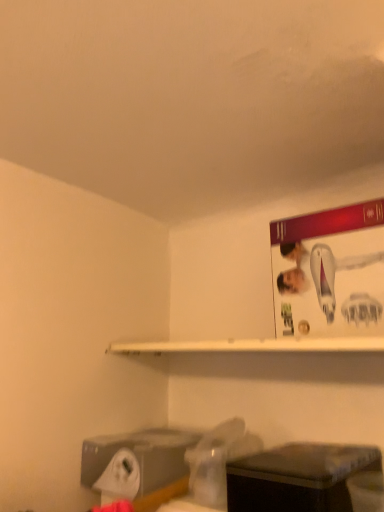
Question: Looking at the image, does white matte shelf at upper center seem bigger or smaller compared to black plastic box at lower right?

Choices:
 (A) big
 (B) small

Answer: (B)

Question: Considering their positions, is white matte shelf at upper center located in front of or behind black plastic box at lower right?

Choices:
 (A) front
 (B) behind

Answer: (B)

Question: From their relative heights in the image, would you say white matte shelf at upper center is taller or shorter than black plastic box at lower right?

Choices:
 (A) tall
 (B) short

Answer: (B)

Question: Looking at their shapes, would you say black plastic box at lower right is wider or thinner than white matte shelf at upper center?

Choices:
 (A) wide
 (B) thin

Answer: (A)

Question: Visually, is black plastic box at lower right positioned to the left or to the right of white matte shelf at upper center?

Choices:
 (A) left
 (B) right

Answer: (B)

Question: From a real-world perspective, is black plastic box at lower right positioned above or below white matte shelf at upper center?

Choices:
 (A) below
 (B) above

Answer: (A)

Question: Is black plastic box at lower right bigger or smaller than white matte shelf at upper center?

Choices:
 (A) small
 (B) big

Answer: (B)